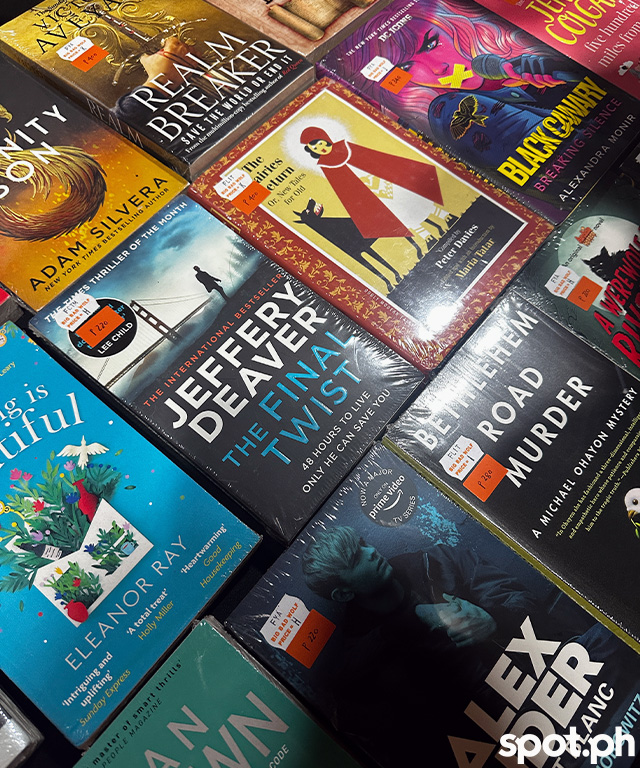
At what (x,y) coordinates should I click in order to perform the action: click on book. Please return your answer as a coordinate pair (x, y). The width and height of the screenshot is (640, 768). Looking at the image, I should click on (377, 280).